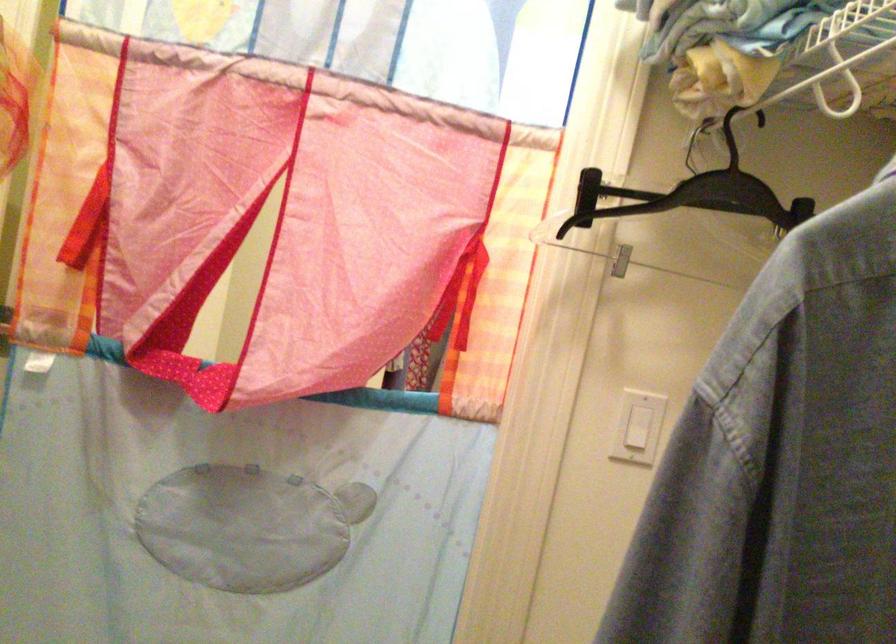
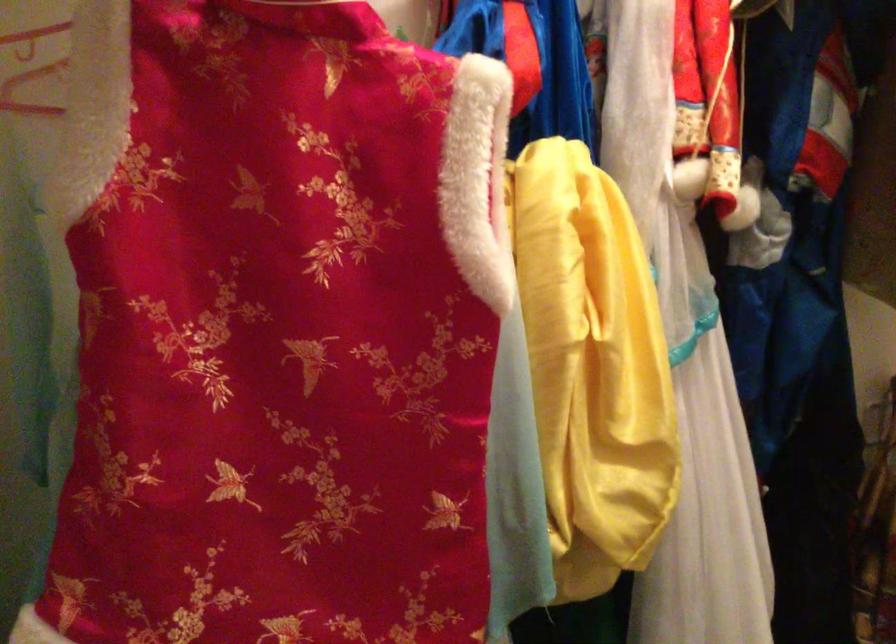
Question: How did the camera likely rotate?

Choices:
 (A) Left
 (B) Right
 (C) Up
 (D) Down

Answer: (A)